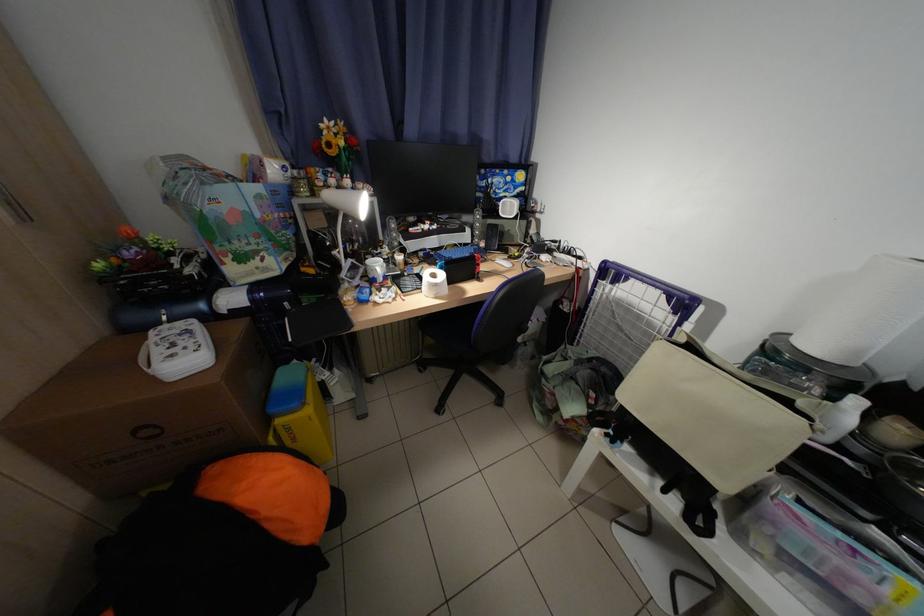
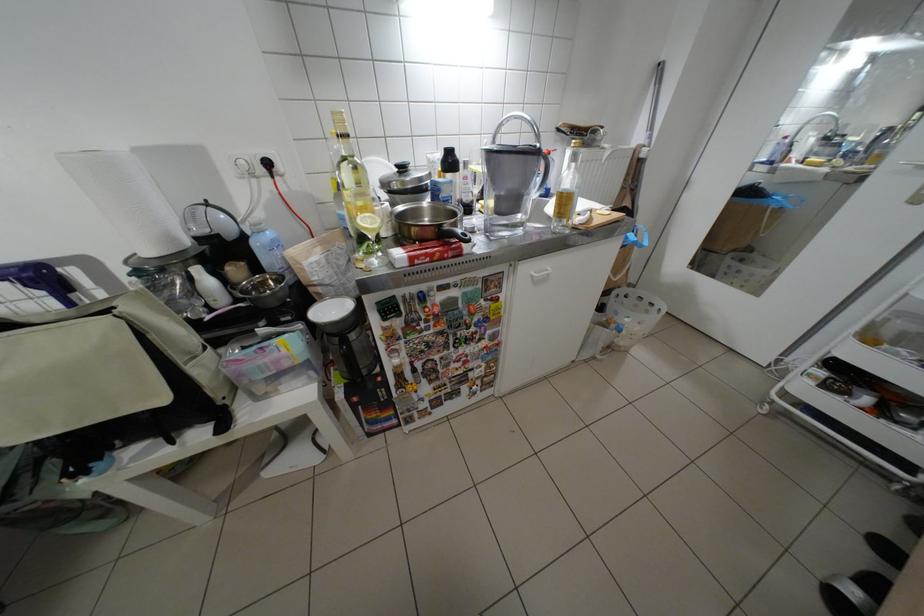
The first image is from the beginning of the video and the second image is from the end. How did the camera likely rotate when shooting the video?

The rotation direction of the camera is right-down.